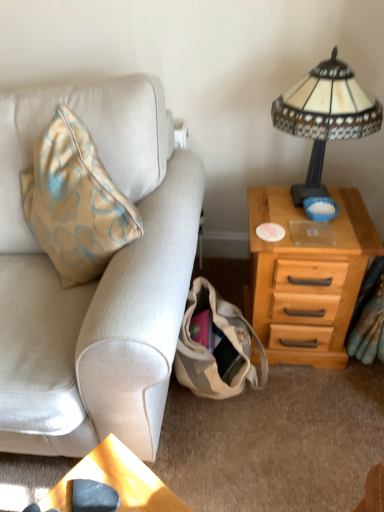
I want to click on beige canvas bag at lower center, so click(x=216, y=346).

Describe the element at coordinates (325, 116) in the screenshot. Image resolution: width=384 pixels, height=512 pixels. I see `stained glass lampshade at upper right` at that location.

At what (x,y) coordinates should I click in order to perform the action: click on beige canvas bag at lower center. Please return your answer as a coordinate pair (x, y). The height and width of the screenshot is (512, 384). Looking at the image, I should click on (216, 346).

Does beige canvas bag at lower center contain beige fabric couch at left?

No, beige fabric couch at left is located outside of beige canvas bag at lower center.

Locate an element on the screen. Image resolution: width=384 pixels, height=512 pixels. studio couch above the beige canvas bag at lower center (from a real-world perspective) is located at coordinates (96, 281).

Which object is positioned more to the left, beige canvas bag at lower center or beige fabric couch at left?

beige fabric couch at left.

Does point (210, 301) lie in front of point (303, 120)?

No, (210, 301) is further to viewer.

From the image's perspective, who appears lower, beige canvas bag at lower center or stained glass lampshade at upper right?

beige canvas bag at lower center is shown below in the image.

Can you tell me how much beige canvas bag at lower center and stained glass lampshade at upper right differ in facing direction?

beige canvas bag at lower center and stained glass lampshade at upper right are facing 0.773 degrees away from each other.

Can you confirm if stained glass lampshade at upper right is bigger than beige fabric couch at left?

No, stained glass lampshade at upper right is not bigger than beige fabric couch at left.

This screenshot has width=384, height=512. I want to click on studio couch located underneath the stained glass lampshade at upper right (from a real-world perspective), so click(x=96, y=281).

Could you tell me if stained glass lampshade at upper right is turned towards beige fabric couch at left?

No.

Consider the image. From a real-world perspective, is stained glass lampshade at upper right positioned above or below beige fabric couch at left?

Clearly, from a real-world perspective, stained glass lampshade at upper right is above beige fabric couch at left.

Find the location of a particular element. nightstand below the beige fabric couch at left (from a real-world perspective) is located at coordinates (307, 278).

From a real-world perspective, is wooden nightstand at right positioned over beige fabric couch at left based on gravity?

Actually, wooden nightstand at right is physically below beige fabric couch at left in the real world.

Is wooden nightstand at right bigger than beige fabric couch at left?

Actually, wooden nightstand at right might be smaller than beige fabric couch at left.

Considering the positions of points (9, 431) and (268, 297), is point (9, 431) closer to camera compared to point (268, 297)?

Yes, it is in front of point (268, 297).

Is beige fabric couch at left smaller than wooden nightstand at right?

No, beige fabric couch at left is not smaller than wooden nightstand at right.

Which object is further away from the camera, beige fabric couch at left or wooden nightstand at right?

wooden nightstand at right is further from the camera.

Is beige fabric couch at left taller or shorter than wooden nightstand at right?

beige fabric couch at left is taller than wooden nightstand at right.

Is stained glass lampshade at upper right next to beige canvas bag at lower center and touching it?

No, stained glass lampshade at upper right is not beside beige canvas bag at lower center.

Considering the sizes of stained glass lampshade at upper right and beige canvas bag at lower center in the image, is stained glass lampshade at upper right taller or shorter than beige canvas bag at lower center?

Considering their sizes, stained glass lampshade at upper right has more height than beige canvas bag at lower center.

From a real-world perspective, which object rests below the other?

From a 3D spatial view, beige canvas bag at lower center is below.

In the scene shown: Is stained glass lampshade at upper right positioned before beige canvas bag at lower center?

Yes, the depth of stained glass lampshade at upper right is less than that of beige canvas bag at lower center.

From a real-world perspective, is beige fabric couch at left above or below beige canvas bag at lower center?

beige fabric couch at left is situated higher than beige canvas bag at lower center in the real world.

How many degrees apart are the facing directions of beige fabric couch at left and beige canvas bag at lower center?

beige fabric couch at left and beige canvas bag at lower center are facing 3.52e-05 degrees away from each other.

Looking at this image, from the image's perspective, does beige fabric couch at left appear higher than beige canvas bag at lower center?

Yes.

Does beige fabric couch at left turn towards beige canvas bag at lower center?

No.

Identify the location of studio couch lying on the left of beige canvas bag at lower center. (96, 281).

In order to click on handbag below the stained glass lampshade at upper right (from a real-world perspective) in this screenshot , I will do `click(216, 346)`.

Looking at the image, which one is located closer to wooden nightstand at right, beige canvas bag at lower center or beige fabric couch at left?

Among the two, beige canvas bag at lower center is located nearer to wooden nightstand at right.

When comparing their distances from wooden nightstand at right, does beige canvas bag at lower center or stained glass lampshade at upper right seem closer?

beige canvas bag at lower center.

Based on their spatial positions, is stained glass lampshade at upper right or wooden nightstand at right further from beige fabric couch at left?

The object further to beige fabric couch at left is stained glass lampshade at upper right.

Estimate the real-world distances between objects in this image. Which object is further from beige fabric couch at left, beige canvas bag at lower center or stained glass lampshade at upper right?

stained glass lampshade at upper right is positioned further to the anchor beige fabric couch at left.

Considering their positions, is wooden nightstand at right positioned closer to stained glass lampshade at upper right than beige canvas bag at lower center?

wooden nightstand at right lies closer to stained glass lampshade at upper right than the other object.

Considering their positions, is stained glass lampshade at upper right positioned further to wooden nightstand at right than beige canvas bag at lower center?

stained glass lampshade at upper right is further to wooden nightstand at right.

Which object lies further to the anchor point beige fabric couch at left, beige canvas bag at lower center or wooden nightstand at right?

Based on the image, wooden nightstand at right appears to be further to beige fabric couch at left.

Consider the image. When comparing their distances from beige canvas bag at lower center, does wooden nightstand at right or stained glass lampshade at upper right seem further?

Based on the image, stained glass lampshade at upper right appears to be further to beige canvas bag at lower center.

Where is `handbag located between beige fabric couch at left and wooden nightstand at right in the left-right direction`? handbag located between beige fabric couch at left and wooden nightstand at right in the left-right direction is located at coordinates (216, 346).

In order to click on nightstand located between beige fabric couch at left and stained glass lampshade at upper right in the left-right direction in this screenshot , I will do `click(307, 278)`.

The height and width of the screenshot is (512, 384). Find the location of `nightstand between stained glass lampshade at upper right and beige canvas bag at lower center in the vertical direction`. nightstand between stained glass lampshade at upper right and beige canvas bag at lower center in the vertical direction is located at coordinates (307, 278).

In order to click on handbag between beige fabric couch at left and stained glass lampshade at upper right from left to right in this screenshot , I will do `click(216, 346)`.